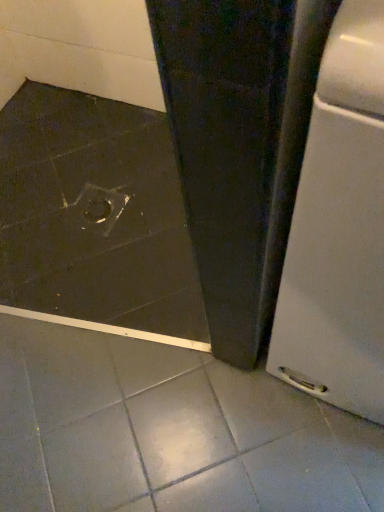
Where is `white matte refrigerator at lower right`? The width and height of the screenshot is (384, 512). white matte refrigerator at lower right is located at coordinates (339, 228).

Describe the element at coordinates (339, 228) in the screenshot. I see `white matte refrigerator at lower right` at that location.

Describe the element at coordinates (98, 208) in the screenshot. I see `transparent plastic drain at center` at that location.

Identify the location of transparent plastic drain at center. Image resolution: width=384 pixels, height=512 pixels. (98, 208).

This screenshot has height=512, width=384. What are the coordinates of `white matte refrigerator at lower right` in the screenshot? It's located at (339, 228).

Is transparent plastic drain at center to the left of white matte refrigerator at lower right from the viewer's perspective?

Indeed, transparent plastic drain at center is positioned on the left side of white matte refrigerator at lower right.

Consider the image. Is the position of transparent plastic drain at center more distant than that of white matte refrigerator at lower right?

Yes, the depth of transparent plastic drain at center is greater than that of white matte refrigerator at lower right.

Which is in front, point (106, 207) or point (299, 382)?

The point (299, 382) is closer to the camera.

From the image's perspective, which is below, transparent plastic drain at center or white matte refrigerator at lower right?

white matte refrigerator at lower right.

From a real-world perspective, relative to white matte refrigerator at lower right, is transparent plastic drain at center vertically above or below?

transparent plastic drain at center is below white matte refrigerator at lower right.

Which of these two, transparent plastic drain at center or white matte refrigerator at lower right, is wider?

white matte refrigerator at lower right is wider.

Is transparent plastic drain at center shorter than white matte refrigerator at lower right?

Yes, transparent plastic drain at center is shorter than white matte refrigerator at lower right.

Which of these two, transparent plastic drain at center or white matte refrigerator at lower right, is smaller?

transparent plastic drain at center.

Is transparent plastic drain at center not inside white matte refrigerator at lower right?

Indeed, transparent plastic drain at center is completely outside white matte refrigerator at lower right.

Is transparent plastic drain at center not near white matte refrigerator at lower right?

No.

Is transparent plastic drain at center facing away from white matte refrigerator at lower right?

No.

Image resolution: width=384 pixels, height=512 pixels. I want to click on home appliance above the transparent plastic drain at center (from a real-world perspective), so click(x=339, y=228).

Is white matte refrigerator at lower right at the right side of transparent plastic drain at center?

Indeed, white matte refrigerator at lower right is positioned on the right side of transparent plastic drain at center.

Looking at this image, is white matte refrigerator at lower right in front of or behind transparent plastic drain at center in the image?

white matte refrigerator at lower right is positioned closer to the viewer than transparent plastic drain at center.

Considering the positions of point (328, 204) and point (83, 222), is point (328, 204) closer or farther from the camera than point (83, 222)?

Point (328, 204) appears to be closer to the viewer than point (83, 222).

From the image's perspective, is white matte refrigerator at lower right located beneath transparent plastic drain at center?

Indeed, from the image's perspective, white matte refrigerator at lower right is shown beneath transparent plastic drain at center.

From the picture: From a real-world perspective, is white matte refrigerator at lower right physically below transparent plastic drain at center?

No, from a real-world perspective, white matte refrigerator at lower right is not beneath transparent plastic drain at center.

Does white matte refrigerator at lower right have a lesser width compared to transparent plastic drain at center?

No, white matte refrigerator at lower right is not thinner than transparent plastic drain at center.

Who is shorter, white matte refrigerator at lower right or transparent plastic drain at center?

transparent plastic drain at center is shorter.

Who is smaller, white matte refrigerator at lower right or transparent plastic drain at center?

transparent plastic drain at center is smaller.

Is white matte refrigerator at lower right completely or partially outside of transparent plastic drain at center?

Absolutely, white matte refrigerator at lower right is external to transparent plastic drain at center.

Looking at this image, are white matte refrigerator at lower right and transparent plastic drain at center making contact?

No, white matte refrigerator at lower right is not beside transparent plastic drain at center.

Could you tell me if white matte refrigerator at lower right is facing transparent plastic drain at center?

No, white matte refrigerator at lower right does not turn towards transparent plastic drain at center.

This screenshot has height=512, width=384. In order to click on drain that appears above the white matte refrigerator at lower right (from the image's perspective) in this screenshot , I will do `click(98, 208)`.

The image size is (384, 512). Identify the location of home appliance located above the transparent plastic drain at center (from a real-world perspective). (339, 228).

At what (x,y) coordinates should I click in order to perform the action: click on home appliance in front of the transparent plastic drain at center. Please return your answer as a coordinate pair (x, y). Image resolution: width=384 pixels, height=512 pixels. Looking at the image, I should click on (339, 228).